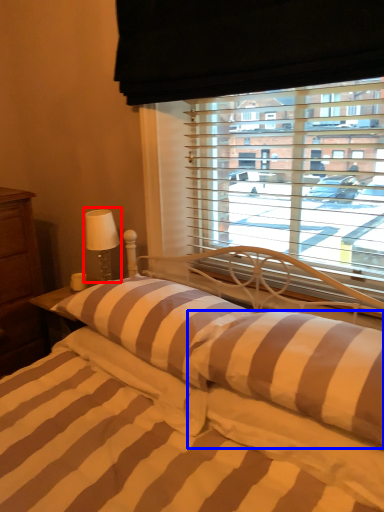
Question: Which object appears closest to the camera in this image, table lamp (highlighted by a red box) or pillow (highlighted by a blue box)?

Choices:
 (A) table lamp
 (B) pillow

Answer: (B)